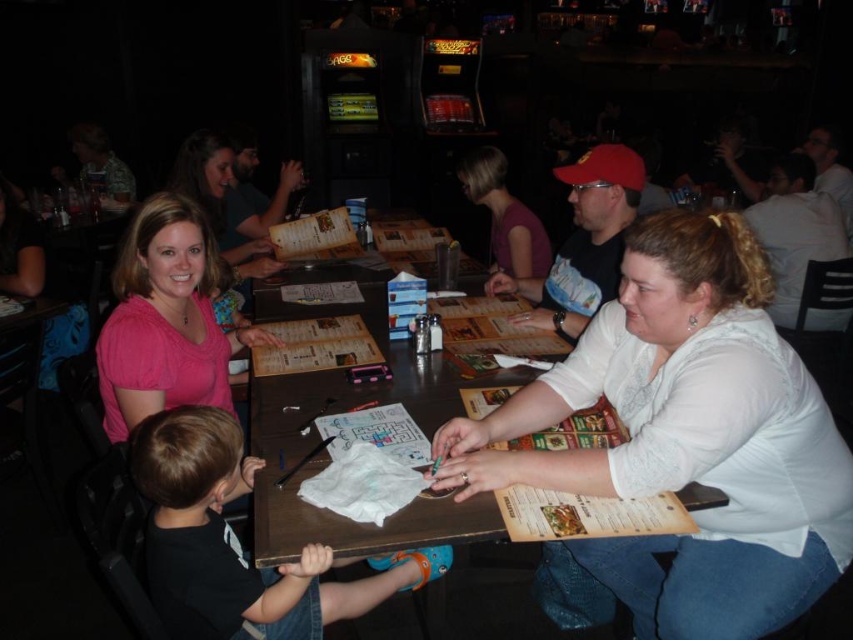
Who is taller, black cotton shirt at lower left or white matte shirt at upper right?

Standing taller between the two is white matte shirt at upper right.

Does black cotton shirt at lower left appear under white matte shirt at upper right?

Indeed, black cotton shirt at lower left is positioned under white matte shirt at upper right.

Which is behind, point (178, 628) or point (782, 260)?

Positioned behind is point (782, 260).

Locate an element on the screen. Image resolution: width=853 pixels, height=640 pixels. black cotton shirt at lower left is located at coordinates (236, 541).

Does pink matte shirt at upper left have a smaller size compared to matte black shirt at center?

Correct, pink matte shirt at upper left occupies less space than matte black shirt at center.

Between point (126, 296) and point (592, 240), which one is positioned in front?

Positioned in front is point (126, 296).

Is point (178, 234) closer to viewer compared to point (549, 285)?

Yes, point (178, 234) is closer to viewer.

At what (x,y) coordinates should I click in order to perform the action: click on pink matte shirt at upper left. Please return your answer as a coordinate pair (x, y). This screenshot has width=853, height=640. Looking at the image, I should click on (165, 320).

Can you confirm if matte black shirt at center is smaller than purple matte shirt at upper center?

No, matte black shirt at center is not smaller than purple matte shirt at upper center.

Is point (606, 200) positioned in front of point (483, 150)?

That is True.

In order to click on matte black shirt at center in this screenshot , I will do `click(583, 243)`.